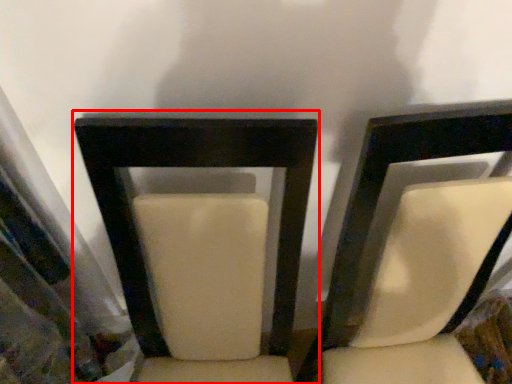
Question: From the image, what is the correct spatial relationship of chair (annotated by the red box) in relation to chair?

Choices:
 (A) right
 (B) left

Answer: (B)